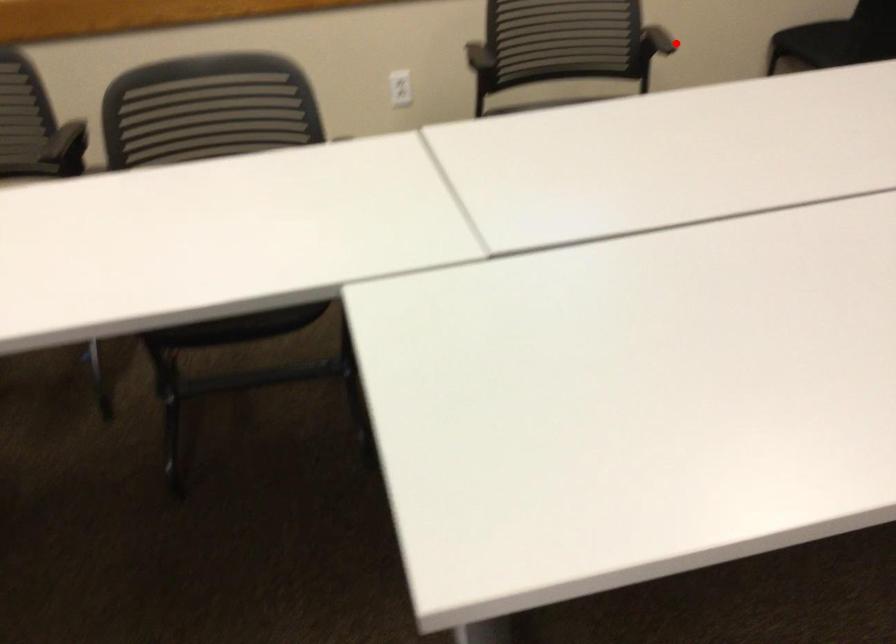
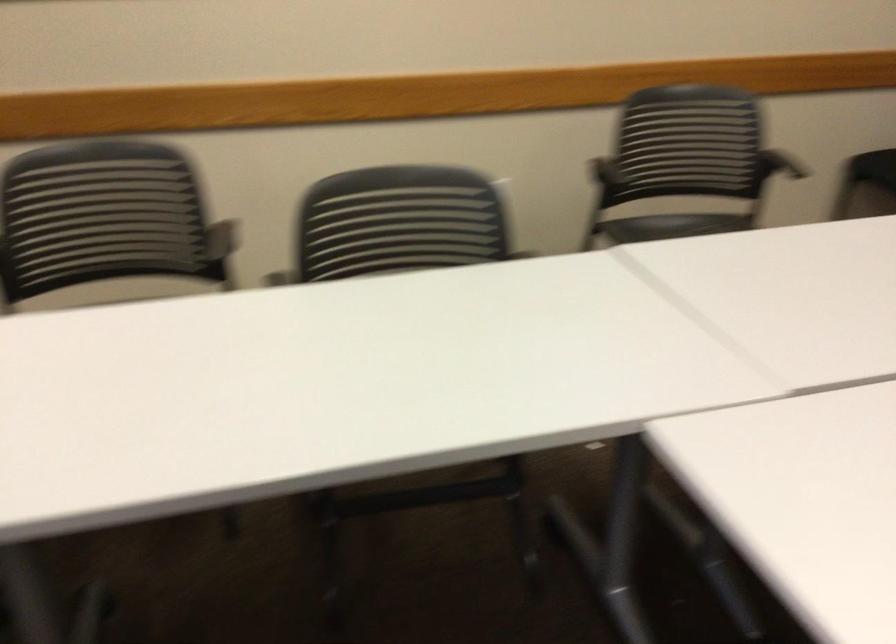
Question: I am providing you with two images of the same scene from different viewpoints. A red point is marked on the first image. Is the red point's position out of view in image 2?

Choices:
 (A) Yes
 (B) No

Answer: (A)